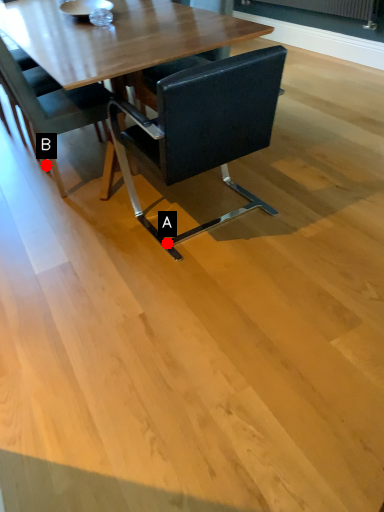
Question: Two points are circled on the image, labeled by A and B beside each circle. Among these points, which one is nearest to the camera?

Choices:
 (A) A is closer
 (B) B is closer

Answer: (A)